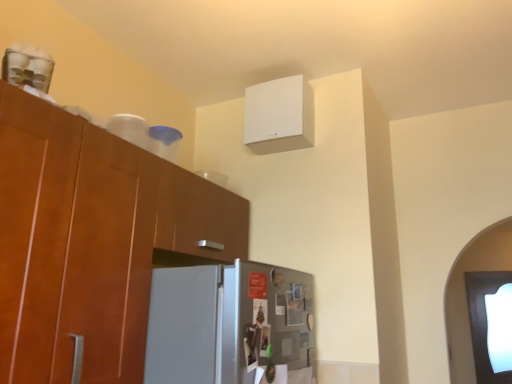
Where is `transparent glass door at lower right`? Image resolution: width=512 pixels, height=384 pixels. transparent glass door at lower right is located at coordinates (484, 322).

In order to face transparent glass door at lower right, should I rotate leftwards or rightwards?

Answer: Rotate your view right by about 29.923°.

What do you see at coordinates (484, 322) in the screenshot? The height and width of the screenshot is (384, 512). I see `transparent glass door at lower right` at bounding box center [484, 322].

What are the coordinates of `transparent glass door at lower right` in the screenshot? It's located at click(484, 322).